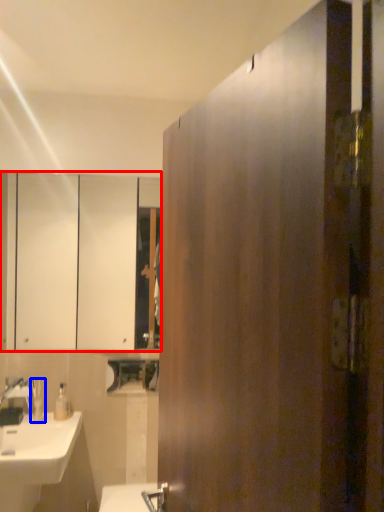
Question: Which point is closer to the camera, cabinetry (highlighted by a red box) or toiletry (highlighted by a blue box)?

Choices:
 (A) cabinetry
 (B) toiletry

Answer: (B)